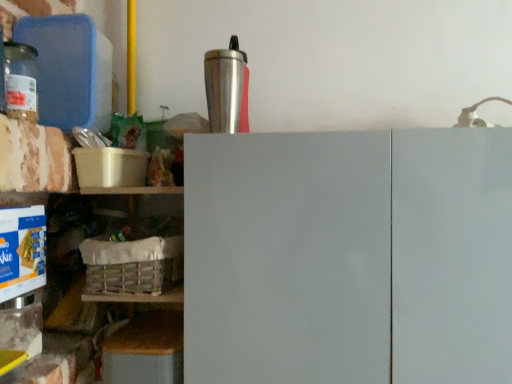
Question: Is point coord(144,284) positioned closer to the camera than point coord(315,367)?

Choices:
 (A) farther
 (B) closer

Answer: (A)

Question: Visually, is white woven basket at lower left positioned to the left or to the right of white matte cabinet doors at center?

Choices:
 (A) left
 (B) right

Answer: (A)

Question: Estimate the real-world distances between objects in this image. Which object is farther from the silver metallic tumbler at upper center?

Choices:
 (A) white matte cabinet doors at center
 (B) wooden crate at lower left
 (C) translucent glass jar at left
 (D) white woven basket at lower left

Answer: (C)

Question: Based on their relative distances, which object is nearer to the silver metallic tumbler at upper center?

Choices:
 (A) wooden crate at lower left
 (B) translucent glass jar at left
 (C) white woven basket at lower left
 (D) white matte cabinet doors at center

Answer: (D)